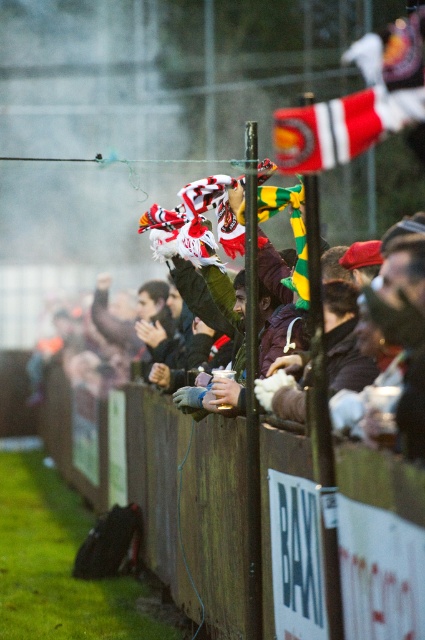
Which is behind, point (223, 298) or point (325, 145)?

The point (223, 298) is more distant.

Image resolution: width=425 pixels, height=640 pixels. I want to click on white and red scarf at center, so click(x=408, y=362).

Who is higher up, wooden fence at center or red and white striped flag at upper right?

red and white striped flag at upper right is above.

Between wooden fence at center and red and white striped flag at upper right, which one appears on the right side from the viewer's perspective?

Positioned to the right is red and white striped flag at upper right.

This screenshot has width=425, height=640. Describe the element at coordinates (130, 467) in the screenshot. I see `wooden fence at center` at that location.

Find the location of a particular element. Image resolution: width=425 pixels, height=640 pixels. wooden fence at center is located at coordinates (130, 467).

Is wooden fence at center taller than white and red scarf at center?

Indeed, wooden fence at center has a greater height compared to white and red scarf at center.

Is point (70, 445) less distant than point (408, 349)?

No, (70, 445) is further to viewer.

This screenshot has width=425, height=640. I want to click on wooden fence at center, so click(130, 467).